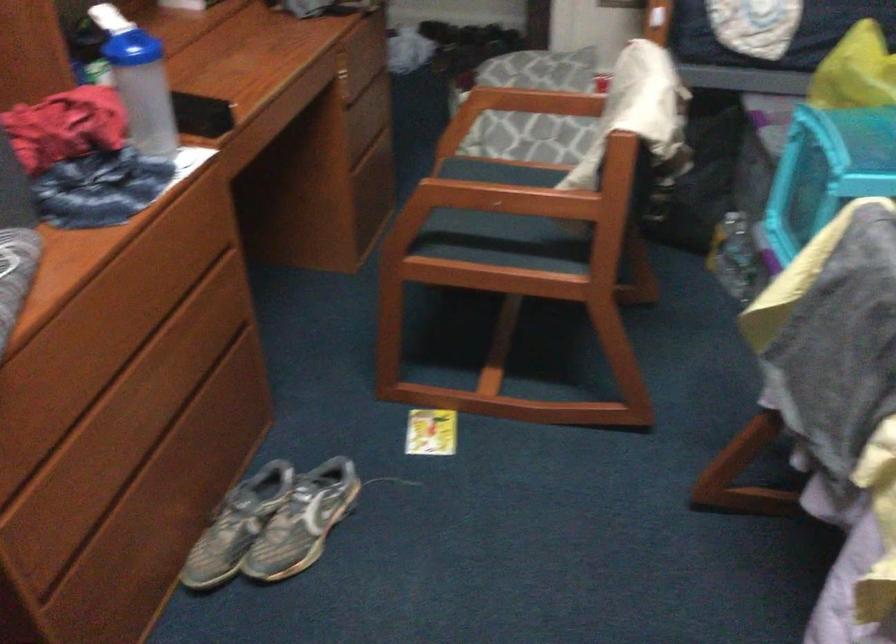
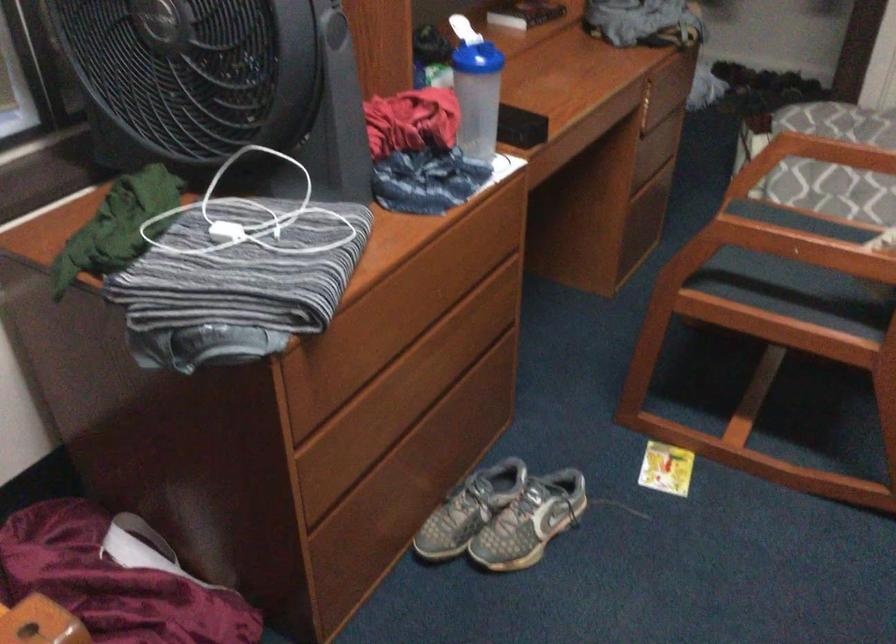
Where in the second image is the point corresponding to point 271,520 from the first image?

(503, 516)